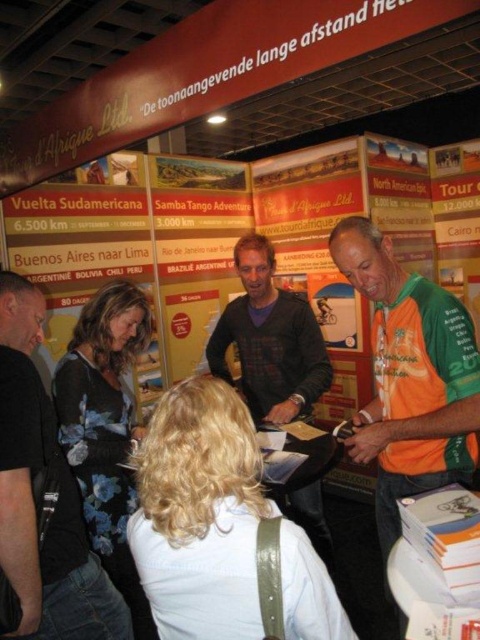
You are attending a travel fair and want to take a photo of the banners behind the black fabric shirt at left and the dark brown sweater at center. Can you position yourself so that both are fully visible in the background without any obstruction?

The black fabric shirt at left is closer to the viewer than the dark brown sweater at center, so positioning yourself behind both objects would allow the banners to be visible in the background without obstruction from either the shirt or sweater.

You are a vendor at the travel fair and need to hand out promotional materials. You have a stack of brochures on the orange jersey at right and a stack of flyers on the dark brown sweater at center. If you want to distribute both materials to a visitor standing between the two items, which stack is closer to the visitor?

The orange jersey at right is closer to the visitor since it is only 22.53 inches away from the dark brown sweater at center, meaning the visitor is in between them and closer to whichever item is nearer. However, without knowing the exact position of the visitor between the two, we can infer that the distance between the two items is 22.53 inches, so the visitor would be closer to whichever item they are nearer to. But based on the given information, the orange jersey at right is positioned at the right, 2

What is the exact coordinate of the orange jersey at right in the image?

The orange jersey at right is located at coordinate point [409,378].